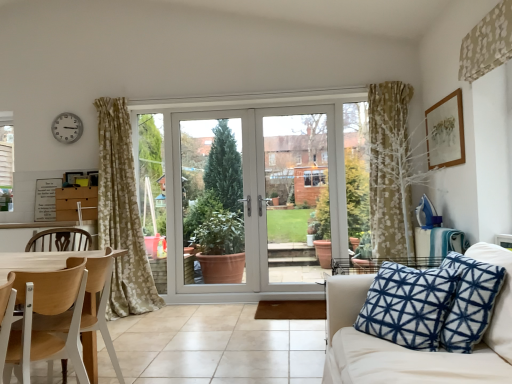
At what (x,y) coordinates should I click in order to perform the action: click on vacant region above clear glass door at center, the second screen door from the left (from a real-world perspective). Please return your answer as a coordinate pair (x, y). The image size is (512, 384). Looking at the image, I should click on (289, 105).